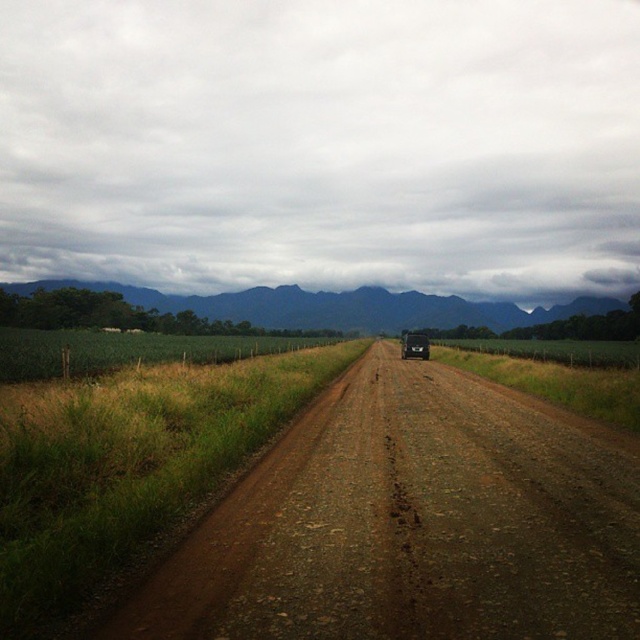
Is brown dirt field at left wider than black matte bus at center?

No, brown dirt field at left is not wider than black matte bus at center.

Identify the location of brown dirt field at left. The width and height of the screenshot is (640, 640). (129, 468).

At what (x,y) coordinates should I click in order to perform the action: click on brown dirt field at left. Please return your answer as a coordinate pair (x, y). Looking at the image, I should click on (129, 468).

Does green grassy field at upper center have a greater height compared to black matte bus at center?

Indeed, green grassy field at upper center has a greater height compared to black matte bus at center.

Which of these two, green grassy field at upper center or black matte bus at center, stands shorter?

black matte bus at center is shorter.

Locate an element on the screen. green grassy field at upper center is located at coordinates (339, 307).

Between point (3, 596) and point (266, 305), which one is positioned behind?

Positioned behind is point (266, 305).

Does point (248, 417) come farther from viewer compared to point (291, 314)?

No, it is in front of (291, 314).

Between point (17, 600) and point (348, 307), which one is positioned in front?

Point (17, 600)

Where is `brown dirt field at left`? brown dirt field at left is located at coordinates [x=129, y=468].